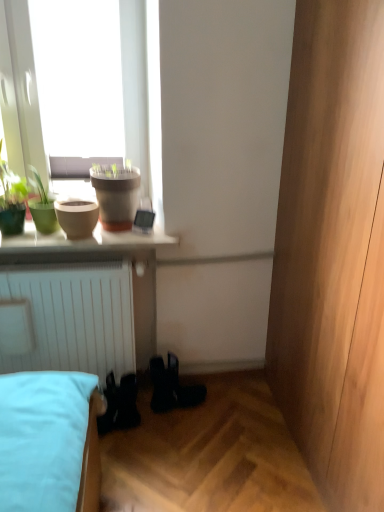
Question: Is green matte pot at upper left, marked as the first houseplant in a right-to-left arrangement, to the left of green matte plant at upper left, the 1th houseplant in the left-to-right sequence, from the viewer's perspective?

Choices:
 (A) yes
 (B) no

Answer: (B)

Question: From the image's perspective, is green matte pot at upper left, the second houseplant in the left-to-right sequence, beneath green matte plant at upper left, the 1th houseplant in the left-to-right sequence?

Choices:
 (A) yes
 (B) no

Answer: (A)

Question: Is green matte pot at upper left, the second houseplant in the left-to-right sequence, taller than green matte plant at upper left, the 1th houseplant in the left-to-right sequence?

Choices:
 (A) no
 (B) yes

Answer: (A)

Question: Considering the relative sizes of green matte pot at upper left, marked as the first houseplant in a right-to-left arrangement, and green matte plant at upper left, the second houseplant when ordered from right to left, in the image provided, is green matte pot at upper left, marked as the first houseplant in a right-to-left arrangement, shorter than green matte plant at upper left, the second houseplant when ordered from right to left,?

Choices:
 (A) no
 (B) yes

Answer: (B)

Question: Is green matte pot at upper left, marked as the first houseplant in a right-to-left arrangement, at the right side of green matte plant at upper left, the 1th houseplant in the left-to-right sequence?

Choices:
 (A) no
 (B) yes

Answer: (B)

Question: From a real-world perspective, is matte beige flowerpot at left, the 1th flowerpot viewed from the left, above or below white glossy shelf at upper center?

Choices:
 (A) below
 (B) above

Answer: (B)

Question: Considering the positions of matte beige flowerpot at left, the 1th flowerpot viewed from the left, and white glossy shelf at upper center in the image, is matte beige flowerpot at left, the 1th flowerpot viewed from the left, wider or thinner than white glossy shelf at upper center?

Choices:
 (A) thin
 (B) wide

Answer: (A)

Question: Is point (94, 204) positioned closer to the camera than point (33, 224)?

Choices:
 (A) farther
 (B) closer

Answer: (A)

Question: Is matte beige flowerpot at left, the 1th flowerpot viewed from the left, bigger or smaller than white glossy shelf at upper center?

Choices:
 (A) big
 (B) small

Answer: (B)

Question: Which is correct: green matte pot at upper left, the second houseplant in the left-to-right sequence, is inside green matte plant at upper left, the 1th houseplant in the left-to-right sequence, or outside of it?

Choices:
 (A) outside
 (B) inside

Answer: (A)

Question: In terms of width, does green matte pot at upper left, marked as the first houseplant in a right-to-left arrangement, look wider or thinner when compared to green matte plant at upper left, the 1th houseplant in the left-to-right sequence?

Choices:
 (A) thin
 (B) wide

Answer: (A)

Question: From the image's perspective, relative to green matte plant at upper left, the second houseplant when ordered from right to left, is green matte pot at upper left, marked as the first houseplant in a right-to-left arrangement, above or below?

Choices:
 (A) above
 (B) below

Answer: (B)

Question: Relative to green matte plant at upper left, the second houseplant when ordered from right to left, is green matte pot at upper left, marked as the first houseplant in a right-to-left arrangement, in front or behind?

Choices:
 (A) front
 (B) behind

Answer: (B)

Question: In terms of width, does white glossy shelf at upper center look wider or thinner when compared to matte clay pot at upper left, arranged as the 1th flowerpot when viewed from the right?

Choices:
 (A) wide
 (B) thin

Answer: (A)

Question: Looking at the image, does white glossy shelf at upper center seem bigger or smaller compared to matte clay pot at upper left, arranged as the 1th flowerpot when viewed from the right?

Choices:
 (A) small
 (B) big

Answer: (A)